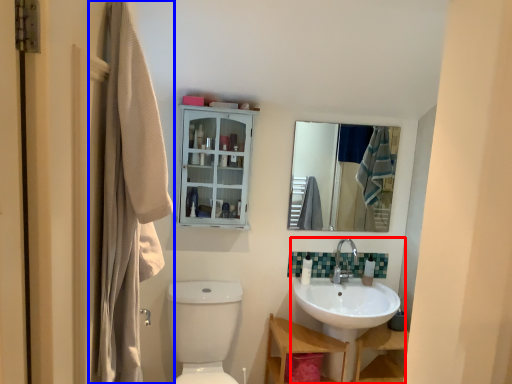
Question: Among these objects, which one is farthest to the camera, sink (highlighted by a red box) or laundry (highlighted by a blue box)?

Choices:
 (A) sink
 (B) laundry

Answer: (A)